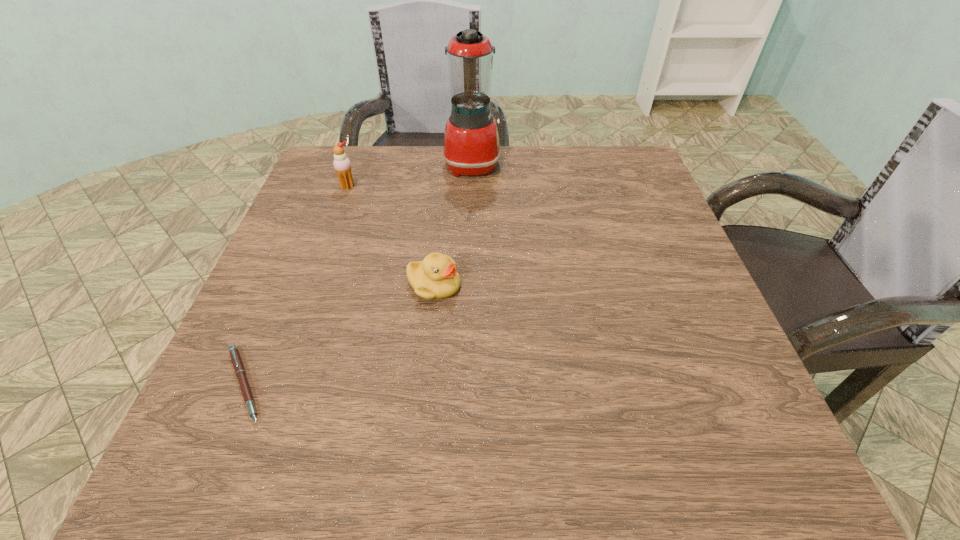
The width and height of the screenshot is (960, 540). What are the coordinates of `vacant space situated 0.390m on the front-facing side of the third tallest object` in the screenshot? It's located at (661, 285).

Locate an element on the screen. The width and height of the screenshot is (960, 540). vacant area situated at the nib of the pen is located at coordinates (405, 384).

At what (x,y) coordinates should I click in order to perform the action: click on food processor that is at the far edge. Please return your answer as a coordinate pair (x, y). The width and height of the screenshot is (960, 540). Looking at the image, I should click on (471, 142).

Where is `icecream that is positioned at the far edge`? icecream that is positioned at the far edge is located at coordinates (342, 165).

Where is `icecream at the left edge`? The width and height of the screenshot is (960, 540). icecream at the left edge is located at coordinates (342, 165).

Where is `pen that is at the left edge`? This screenshot has width=960, height=540. pen that is at the left edge is located at coordinates (237, 363).

The width and height of the screenshot is (960, 540). In order to click on object located in the far left corner section of the desktop in this screenshot , I will do `click(342, 165)`.

What are the coordinates of `vacant space at the far edge` in the screenshot? It's located at (399, 161).

Find the location of a particular element. vacant region at the near edge is located at coordinates (391, 455).

The image size is (960, 540). Find the location of `blank area at the left edge`. blank area at the left edge is located at coordinates pyautogui.click(x=323, y=355).